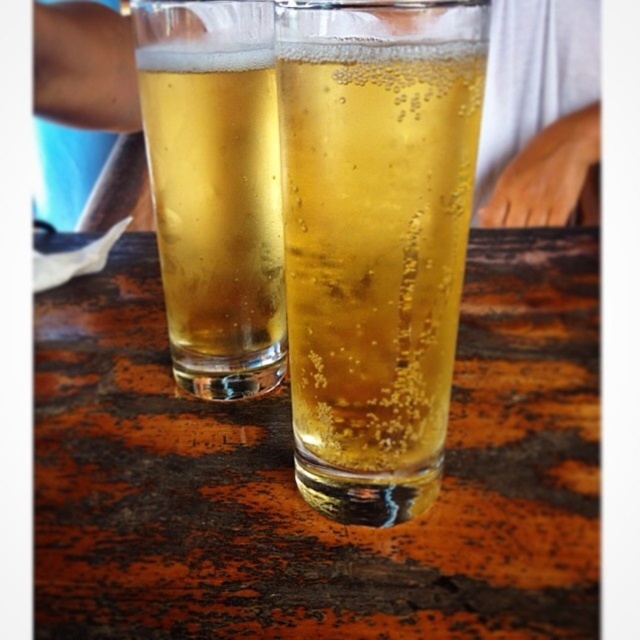
Question: Which object appears farthest from the camera in this image?

Choices:
 (A) translucent glass at left
 (B) wooden table at center

Answer: (A)

Question: Does wooden table at center appear on the left side of translucent glass at center?

Choices:
 (A) yes
 (B) no

Answer: (A)

Question: Which object is closer to the camera taking this photo?

Choices:
 (A) wooden table at center
 (B) translucent glass at left

Answer: (A)

Question: Which object is closer to the camera taking this photo?

Choices:
 (A) translucent glass at center
 (B) translucent glass at left

Answer: (A)

Question: Is wooden table at center wider than translucent glass at left?

Choices:
 (A) yes
 (B) no

Answer: (A)

Question: Can you confirm if translucent glass at center is wider than translucent glass at left?

Choices:
 (A) no
 (B) yes

Answer: (B)